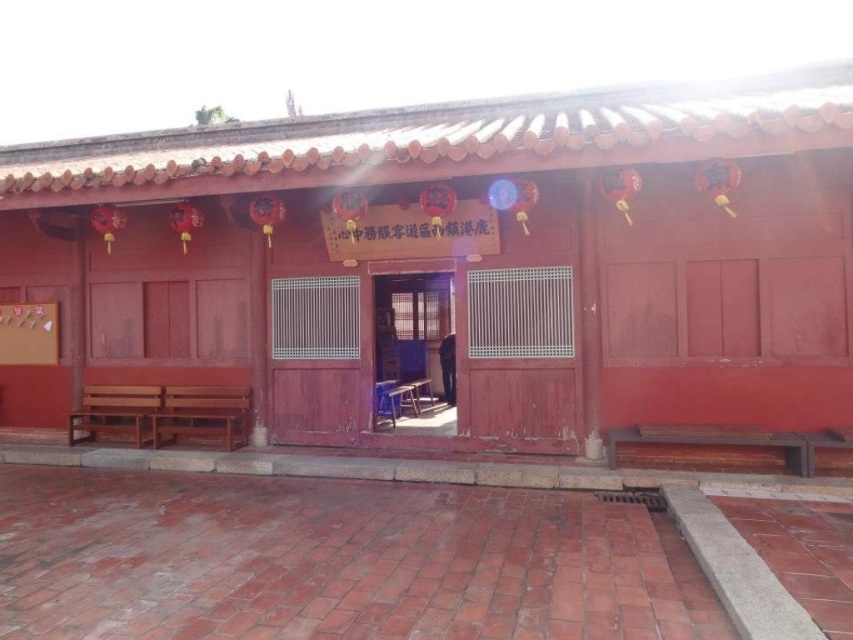
You are standing in front of the traditional building and notice two points marked on its facade. The first point is at coordinates point (392, 196) and the second is at point (395, 320). Which of these two points is closer to you?

Point (392, 196) is closer to the viewer than point (395, 320).

You are standing at the entrance of the building and want to locate the matte wood hut at center. According to the coordinates provided, where should you look relative to your current position?

The matte wood hut at center is located at coordinates point [467,268], so you should look slightly to the right and upward from your current position at the entrance.